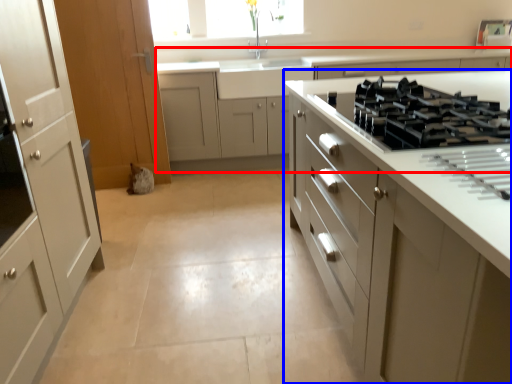
Question: Which point is further to the camera, cabinetry (highlighted by a red box) or cabinetry (highlighted by a blue box)?

Choices:
 (A) cabinetry
 (B) cabinetry

Answer: (A)